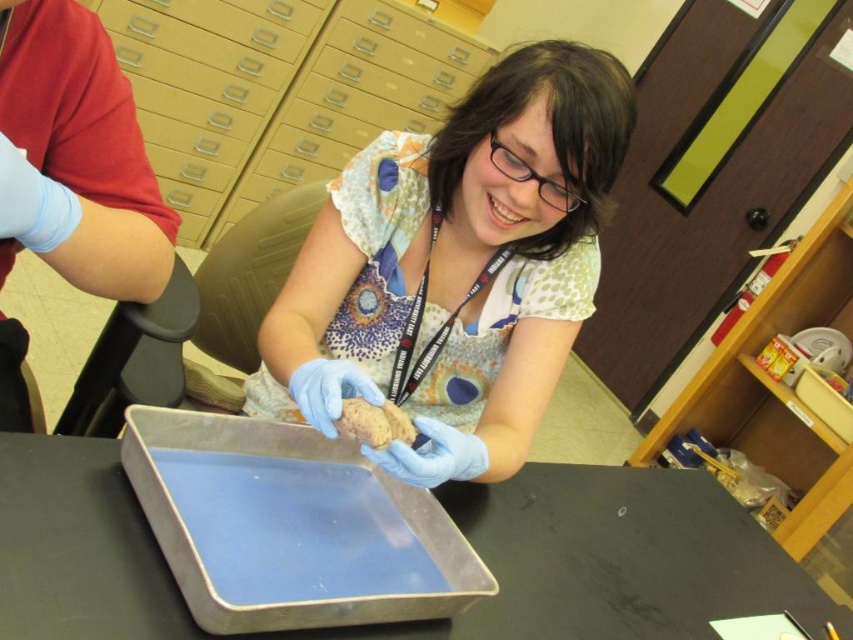
You are an assistant in a science lab. You see a matte brown rock at center and a metallic gray tray at center on the table. Which object is closer to you?

The matte brown rock at center is closer to you because it is positioned further to the viewer than the metallic gray tray at center.

You are standing in front of the table with the metallic tray containing blue liquid. There are two points marked on the tray. The first point is at coordinate point (x=419, y=470) and the second point is at coordinate point (x=645, y=573). Which point is closer to you?

Point (x=419, y=470) is closer to the viewer than point (x=645, y=573).

You are a scientist in a lab who needs to place the matte brown rock at center into the metallic gray tray at center. Based on the scene description, will the rock fit into the tray?

The matte brown rock at center has a greater height compared to the metallic gray tray at center, so the rock may not fit into the tray due to its height being larger than the tray.